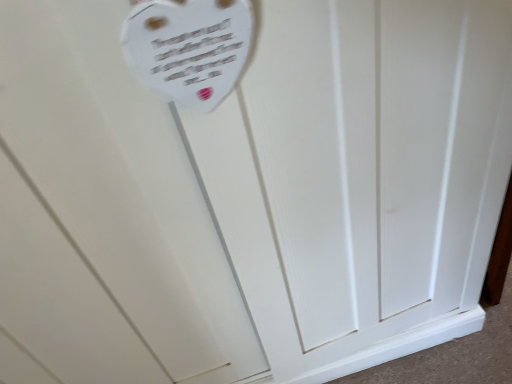
What do you see at coordinates (188, 47) in the screenshot?
I see `white paper heart at upper left` at bounding box center [188, 47].

Locate an element on the screen. Image resolution: width=512 pixels, height=384 pixels. white paper heart at upper left is located at coordinates (188, 47).

Measure the distance between white paper heart at upper left and camera.

38.96 centimeters.

Where is `white paper heart at upper left`? The height and width of the screenshot is (384, 512). white paper heart at upper left is located at coordinates (188, 47).